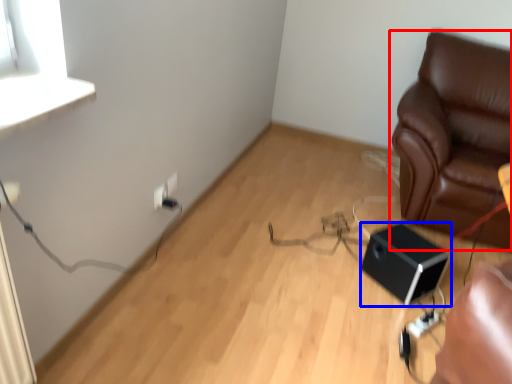
Question: Which of the following is the farthest to the observer, furniture (highlighted by a red box) or speaker (highlighted by a blue box)?

Choices:
 (A) furniture
 (B) speaker

Answer: (B)